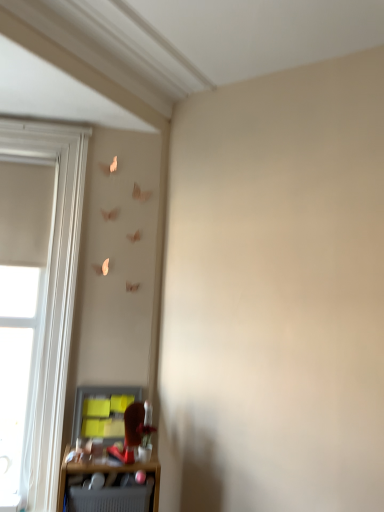
Question: Is matte gray shelf at lower left surrounding matte gray cabinet at lower left?

Choices:
 (A) yes
 (B) no

Answer: (B)

Question: From a real-world perspective, is matte gray shelf at lower left on top of matte gray cabinet at lower left?

Choices:
 (A) yes
 (B) no

Answer: (B)

Question: Is matte gray shelf at lower left wider than matte gray cabinet at lower left?

Choices:
 (A) yes
 (B) no

Answer: (A)

Question: Is matte gray shelf at lower left taller than matte gray cabinet at lower left?

Choices:
 (A) no
 (B) yes

Answer: (A)

Question: Does matte gray shelf at lower left come behind matte gray cabinet at lower left?

Choices:
 (A) no
 (B) yes

Answer: (A)

Question: In the image, is matte gray shelf at lower left positioned in front of or behind matte gray cabinet at lower left?

Choices:
 (A) front
 (B) behind

Answer: (A)

Question: Is matte gray shelf at lower left to the left or to the right of matte gray cabinet at lower left in the image?

Choices:
 (A) left
 (B) right

Answer: (B)

Question: Based on their sizes in the image, would you say matte gray shelf at lower left is bigger or smaller than matte gray cabinet at lower left?

Choices:
 (A) small
 (B) big

Answer: (B)

Question: From the image's perspective, is matte gray shelf at lower left positioned above or below matte gray cabinet at lower left?

Choices:
 (A) above
 (B) below

Answer: (B)

Question: Considering the positions of matte gray shelf at lower left and white wood window at left in the image, is matte gray shelf at lower left wider or thinner than white wood window at left?

Choices:
 (A) wide
 (B) thin

Answer: (A)

Question: Considering the positions of matte gray shelf at lower left and white wood window at left in the image, is matte gray shelf at lower left taller or shorter than white wood window at left?

Choices:
 (A) tall
 (B) short

Answer: (B)

Question: Is matte gray shelf at lower left bigger or smaller than white wood window at left?

Choices:
 (A) small
 (B) big

Answer: (A)

Question: Is point (112, 492) positioned closer to the camera than point (29, 493)?

Choices:
 (A) farther
 (B) closer

Answer: (B)

Question: From the image's perspective, is matte gray cabinet at lower left positioned above or below white wood window at left?

Choices:
 (A) above
 (B) below

Answer: (B)

Question: In the image, is matte gray cabinet at lower left positioned in front of or behind white wood window at left?

Choices:
 (A) front
 (B) behind

Answer: (B)